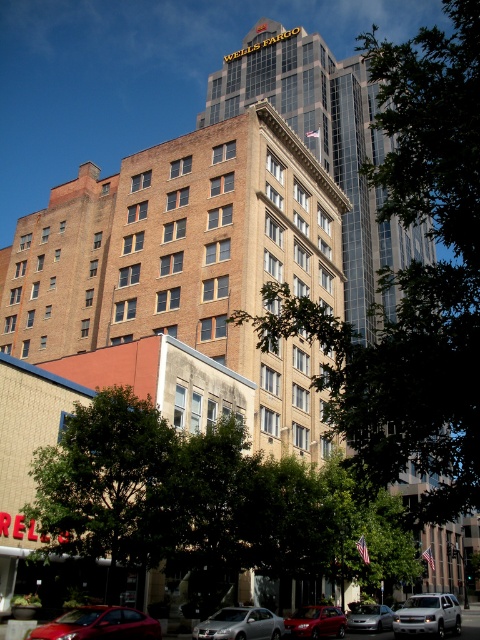
You are a delivery driver trying to park your truck, which is 2 meters wide, in the parking lot near the shiny red sedan at lower left and the silver metallic sedan at center. Based on the scene, can you determine if the space between these two cars is wide enough for your truck?

The shiny red sedan at lower left might be wider than the silver metallic sedan at center, so the space between them may not be wide enough for your 2 meter wide truck. It is uncertain without exact measurements.